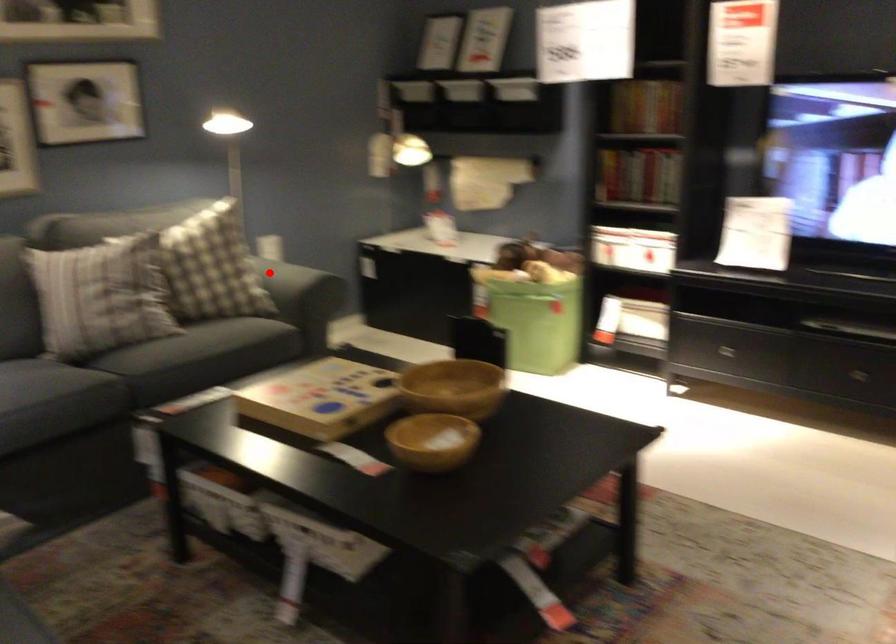
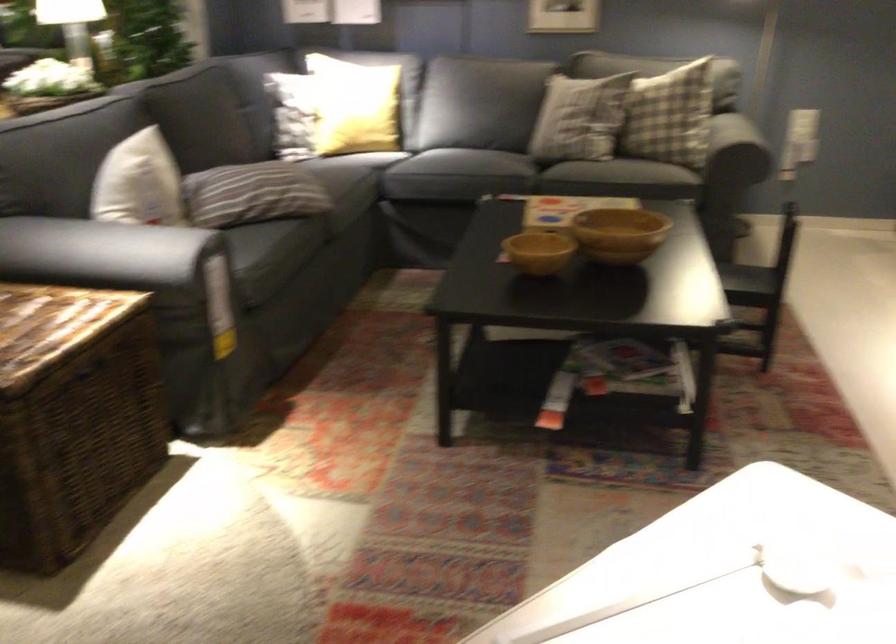
In the second image, find the point that corresponds to the highlighted location in the first image.

(668, 115)